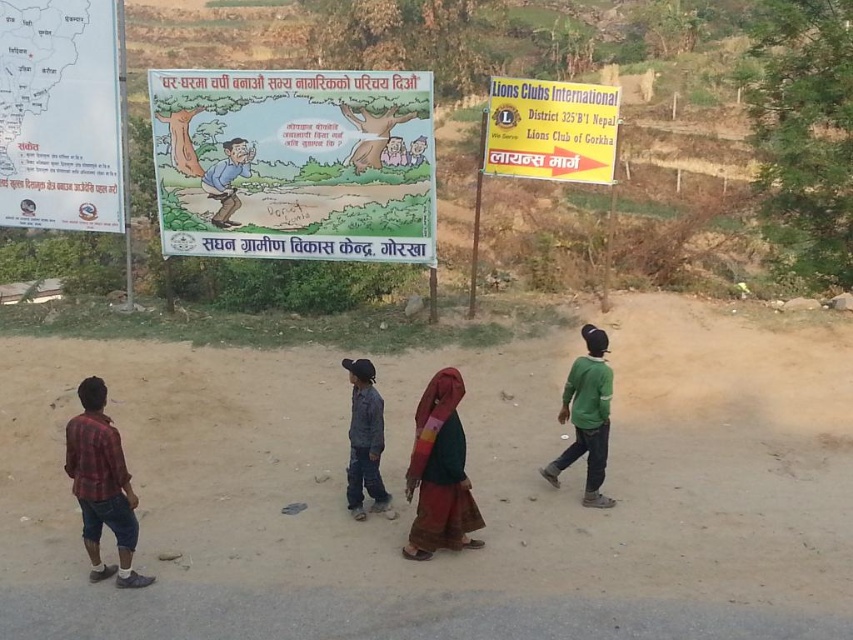
You are standing on the dirt road in the rural scene. You see two points marked as point 1 at coordinates [386,220] and point 2 at coordinates [439,544]. Which point is closer to you?

Point 1 at coordinates [386,220] is closer to you because it is further to the viewer than point 2 at coordinates [439,544].

You are standing on the dirt road in the rural scene and want to take a photo of both the point at coordinates point[68,104] and point[105,413] in the image. Which point should you focus on first to ensure both are in clear view?

You should focus on point[68,104] first because it is closer to the camera than point[105,413]. By focusing on the closer point, both points will be in clear view due to the depth of field.

You are standing on the dirt road and want to read the text on the matte paper poster at center. Considering your eyesight, which is normal, can you clearly see the text from your current position 10.41 meters away?

The matte paper poster at center is 10.41 meters away from the viewer. With normal eyesight, it might be challenging to read the text clearly from that distance, as typical reading distance for small text is around 2.5 meters. However, larger text or graphics might be discernible.